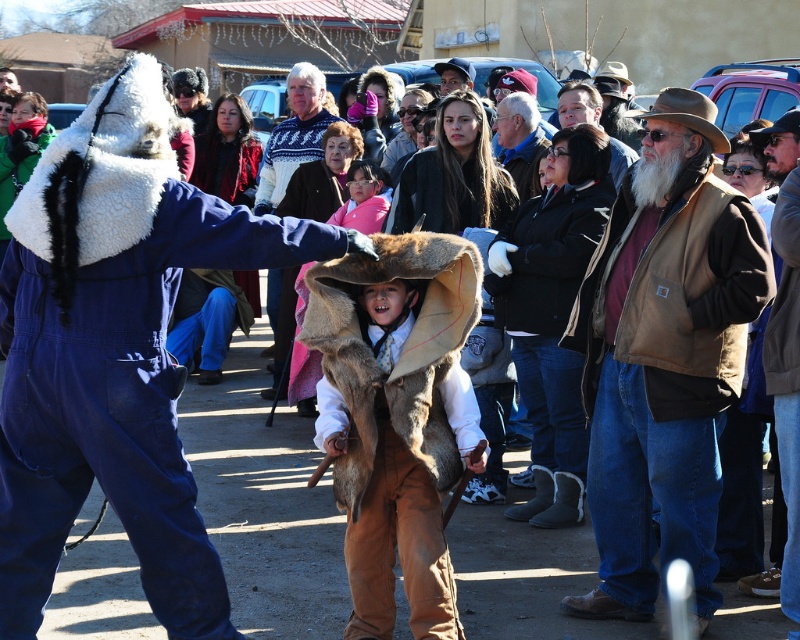
At what (x,y) coordinates should I click in order to perform the action: click on gray woolen hat at center. Please return your answer as a coordinate pair (x, y). Looking at the image, I should click on (520, 138).

Can you confirm if gray woolen hat at center is taller than pink fleece jacket at center?

Indeed, gray woolen hat at center has a greater height compared to pink fleece jacket at center.

Locate an element on the screen. gray woolen hat at center is located at coordinates (520, 138).

Find the location of a particular element. gray woolen hat at center is located at coordinates coord(520,138).

Who is taller, brown suede vest at center or pink fleece jacket at center?

Standing taller between the two is brown suede vest at center.

Is point (648, 550) positioned in front of point (362, 198)?

Yes, point (648, 550) is closer to viewer.

Locate an element on the screen. brown suede vest at center is located at coordinates (664, 356).

Who is more distant from viewer, (288,140) or (498,129)?

The point (288,140) is more distant.

Between knitted sweater at center and gray woolen hat at center, which one appears on the right side from the viewer's perspective?

From the viewer's perspective, gray woolen hat at center appears more on the right side.

Find the location of a particular element. This screenshot has height=640, width=800. knitted sweater at center is located at coordinates (297, 150).

Locate an element on the screen. knitted sweater at center is located at coordinates click(297, 150).